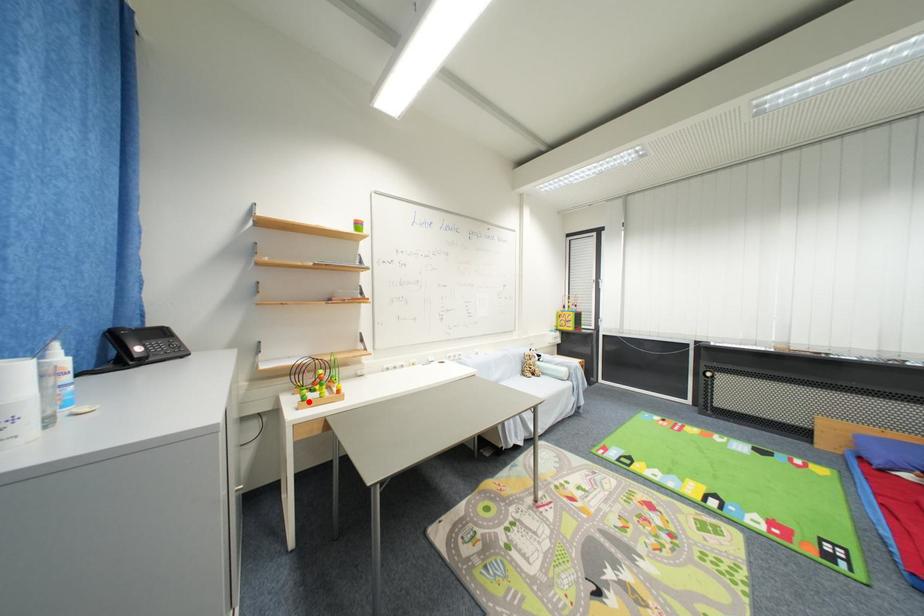
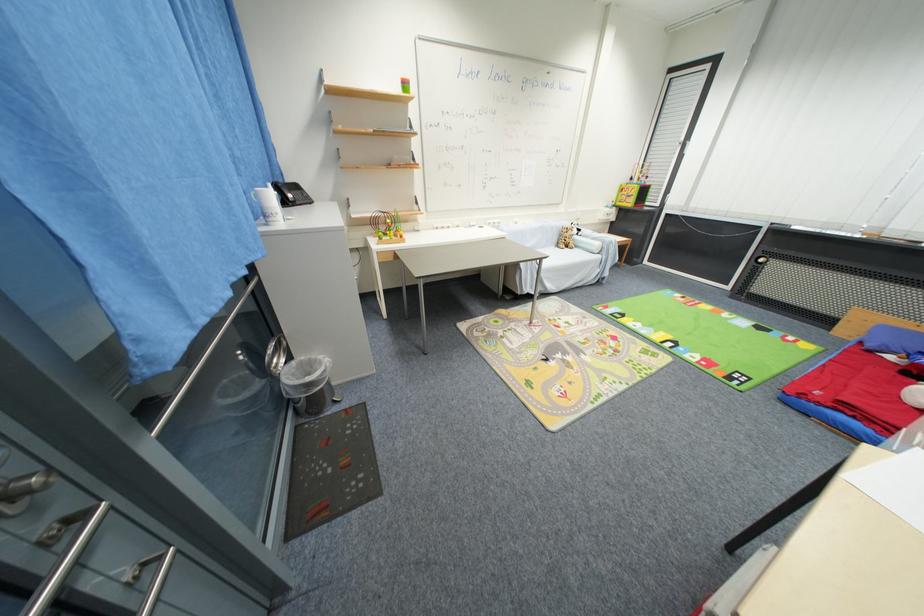
The point at the highlighted location is marked in the first image. Where is the corresponding point in the second image?

(385, 241)